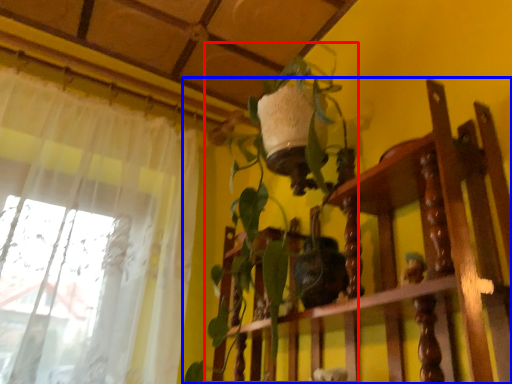
Question: Which object appears farthest to the camera in this image, vegetation (highlighted by a red box) or furniture (highlighted by a blue box)?

Choices:
 (A) vegetation
 (B) furniture

Answer: (A)